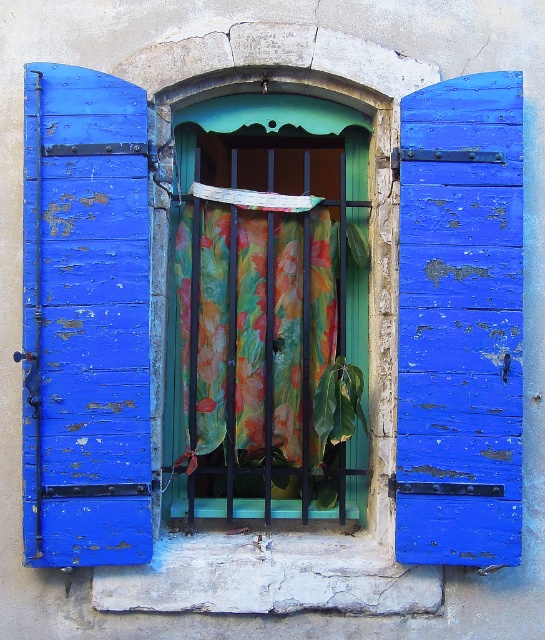
Question: From the image, what is the correct spatial relationship of peeling blue wood at right in relation to floral fabric at center?

Choices:
 (A) below
 (B) above

Answer: (B)

Question: Which point is farther to the camera?

Choices:
 (A) (219, 307)
 (B) (511, 134)
 (C) (269, 156)
 (D) (69, 97)

Answer: (C)

Question: Is peeling blue wood at right further to the viewer compared to floral fabric at center?

Choices:
 (A) no
 (B) yes

Answer: (A)

Question: Is blue peeling wood at left above floral fabric at center?

Choices:
 (A) yes
 (B) no

Answer: (A)

Question: Which of the following is the farthest from the observer?

Choices:
 (A) floral fabric curtain at center
 (B) peeling blue wood at right

Answer: (A)

Question: Which of the following is the closest to the observer?

Choices:
 (A) pyautogui.click(x=324, y=228)
 (B) pyautogui.click(x=57, y=268)

Answer: (B)